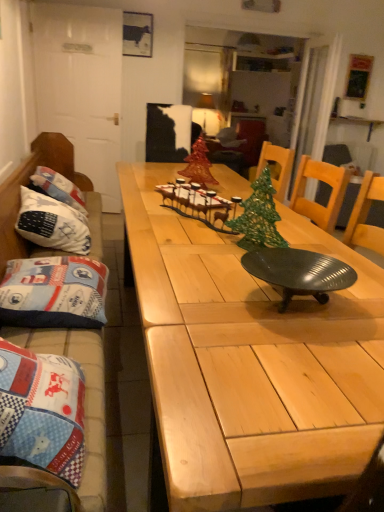
Question: Is point (279, 237) closer or farther from the camera than point (86, 222)?

Choices:
 (A) farther
 (B) closer

Answer: (B)

Question: Is green metallic christmas tree at center, placed as the 1th christmas tree when sorted from front to back, situated inside white fabric pillow at left, which is counted as the first pillow, starting from the back, or outside?

Choices:
 (A) outside
 (B) inside

Answer: (A)

Question: Which is nearer to the blue quilted cushion at left?

Choices:
 (A) shiny red glass christmas tree at center, the 1th christmas tree from the left
 (B) natural wood table at center
 (C) blue fabric pillow at left, which appears as the second pillow when viewed from the back
 (D) green metallic christmas tree at center, placed as the first christmas tree when sorted from bottom to top
 (E) metallic dark green tray at center

Answer: (C)

Question: Which object is the farthest from the green metallic christmas tree at center, placed as the first christmas tree when sorted from bottom to top?

Choices:
 (A) white fabric pillow at left, which is counted as the first pillow, starting from the back
 (B) blue quilted cushion at left
 (C) blue fabric pillow at left, which appears as the second pillow when viewed from the back
 (D) metallic dark green tray at center
 (E) shiny red glass christmas tree at center, the first christmas tree in the back-to-front sequence

Answer: (B)